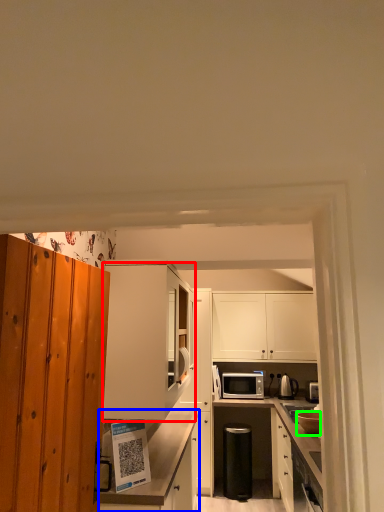
Question: Based on their relative distances, which object is farther from cabinetry (highlighted by a red box)? Choose from cabinetry (highlighted by a blue box) and appliance (highlighted by a green box).

Choices:
 (A) cabinetry
 (B) appliance

Answer: (B)